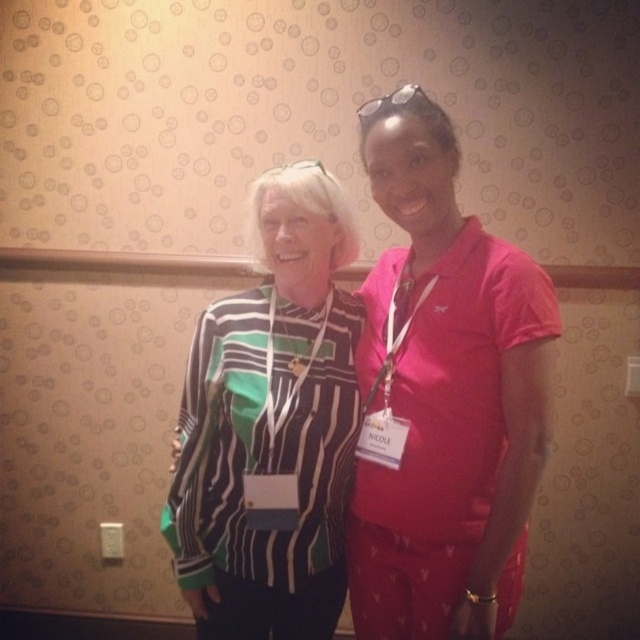
You are a photographer setting up a shoot in a room with a patterned beige wall. You notice two subjects wearing a pink matte shirt at center and a striped knit sweater at center. Which clothing item will appear larger in your photos due to its position?

The pink matte shirt at center will appear larger in the photos because it is closer to the viewer than the striped knit sweater at center.